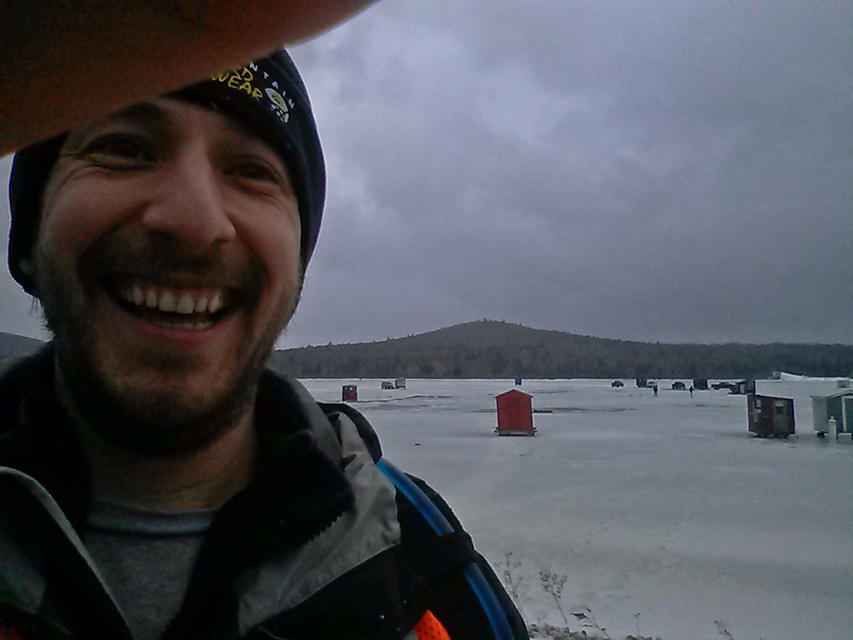
Question: Is matte black jacket at center smaller than white matte snow at center?

Choices:
 (A) yes
 (B) no

Answer: (A)

Question: Is matte black jacket at center to the right of white matte snow at center from the viewer's perspective?

Choices:
 (A) no
 (B) yes

Answer: (A)

Question: Among these objects, which one is farthest from the camera?

Choices:
 (A) matte black jacket at center
 (B) white matte snow at center

Answer: (B)

Question: Which point is farther to the camera?

Choices:
 (A) (469, 440)
 (B) (265, 624)

Answer: (A)

Question: Is matte black jacket at center wider than white matte snow at center?

Choices:
 (A) yes
 (B) no

Answer: (B)